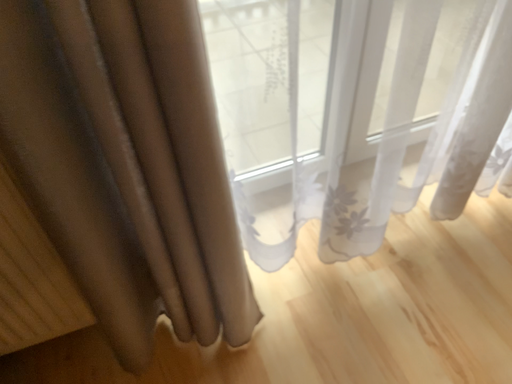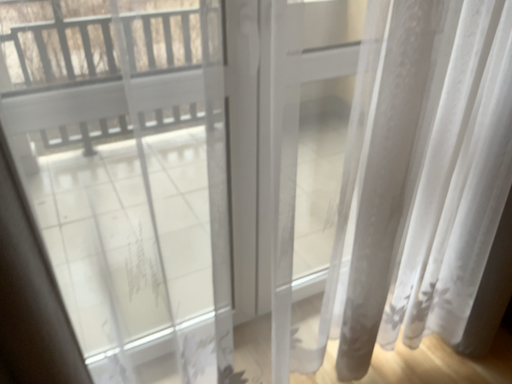
Question: Which way did the camera rotate in the video?

Choices:
 (A) rotated downward
 (B) rotated upward

Answer: (B)